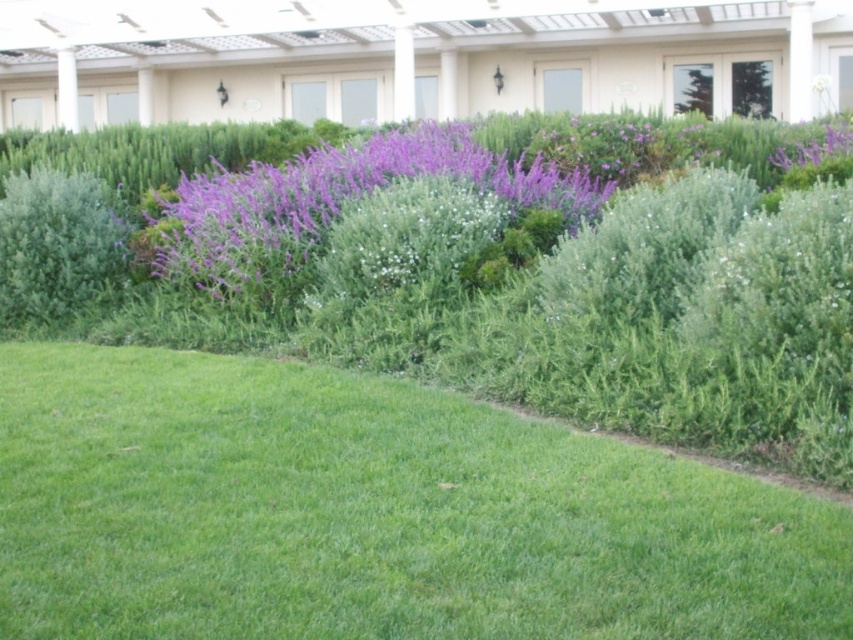
Question: Does green grass at lower left lie in front of purple soft-textured flowers at center?

Choices:
 (A) yes
 (B) no

Answer: (A)

Question: Which point is closer to the camera?

Choices:
 (A) green fuzzy bush at left
 (B) purple soft-textured flowers at center
 (C) purple matte flower at upper right
 (D) green grass at lower left

Answer: (D)

Question: Where is green grass at lower left located in relation to green fuzzy bush at left in the image?

Choices:
 (A) above
 (B) below

Answer: (B)

Question: Based on their relative distances, which object is farther from the green fuzzy bush at left?

Choices:
 (A) purple matte flower at upper right
 (B) purple soft-textured flowers at center

Answer: (A)

Question: Is green grass at lower left bigger than purple soft-textured flowers at center?

Choices:
 (A) no
 (B) yes

Answer: (A)

Question: Considering the real-world distances, which object is farthest from the green grass at lower left?

Choices:
 (A) green fuzzy bush at left
 (B) purple matte flower at upper right
 (C) purple soft-textured flowers at center

Answer: (B)